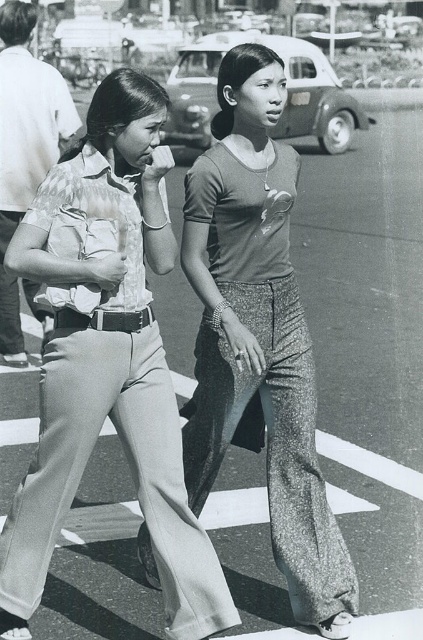
You are standing at the pedestrian crossing in the image. There is a point marked at coordinates (109, 369). What object is located at that point?

The point at coordinates (109, 369) corresponds to the matte beige pants at center.

You are a fashion designer analyzing the image of two women crossing the street. You need to determine which pair of pants has a larger size between the matte beige pants at center and the matte gray pants at center. Which one should you choose?

The matte gray pants at center is larger than the matte beige pants at center, so you should choose the matte gray pants at center.

You are a photographer trying to capture a candid shot of the two people crossing the street. You want to ensure that the person wearing the matte beige pants at center is in focus while the matte gray pants at center is slightly blurred in the background. Based on their positions, which direction should you aim the camera to achieve this effect?

Since the matte beige pants at center is to the left of matte gray pants at center, you should aim the camera towards the left side of the frame to focus on the matte beige pants at center while the matte gray pants at center will naturally be blurred in the background due to their relative positions.